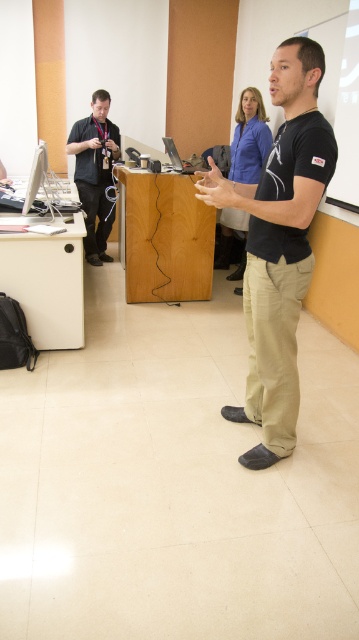
Does matte black lanyard at left have a lesser width compared to black matte shirt at center?

In fact, matte black lanyard at left might be wider than black matte shirt at center.

Who is higher up, matte black lanyard at left or black matte shirt at center?

black matte shirt at center is above.

What do you see at coordinates (95, 172) in the screenshot? The height and width of the screenshot is (640, 359). I see `matte black lanyard at left` at bounding box center [95, 172].

Find the location of a particular element. This screenshot has height=640, width=359. matte black lanyard at left is located at coordinates (95, 172).

Between black matte shirt at center and silver metallic laptop at center, which one appears on the right side from the viewer's perspective?

From the viewer's perspective, black matte shirt at center appears more on the right side.

Does point (257, 116) come behind point (174, 147)?

Yes, point (257, 116) is farther from viewer.

Where is `black matte shirt at center`? Image resolution: width=359 pixels, height=640 pixels. black matte shirt at center is located at coordinates (249, 138).

Is point (257, 401) less distant than point (245, 138)?

Yes, point (257, 401) is in front of point (245, 138).

Who is more distant from viewer, (292, 282) or (259, 172)?

The point (259, 172) is more distant.

This screenshot has height=640, width=359. What are the coordinates of `black cotton shirt at center` in the screenshot? It's located at (278, 244).